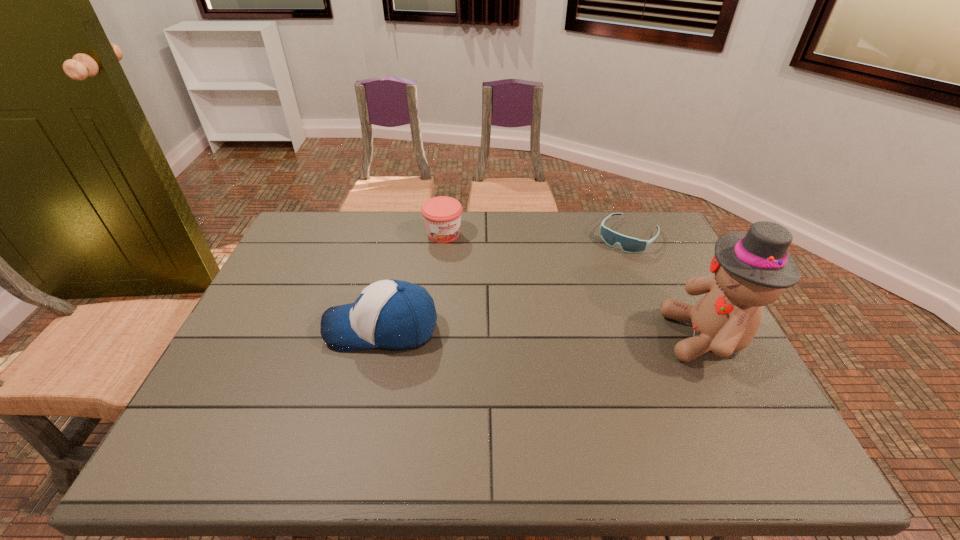
The height and width of the screenshot is (540, 960). In order to click on vacant space on the desktop that is between the baseball cap and the tallest object and is positioned on the front-facing side of the goggles in this screenshot , I will do `click(547, 333)`.

Identify the location of free space on the desktop that is between the second tallest object and the rag_doll and is positioned on the front label of the third tallest object. Image resolution: width=960 pixels, height=540 pixels. (514, 332).